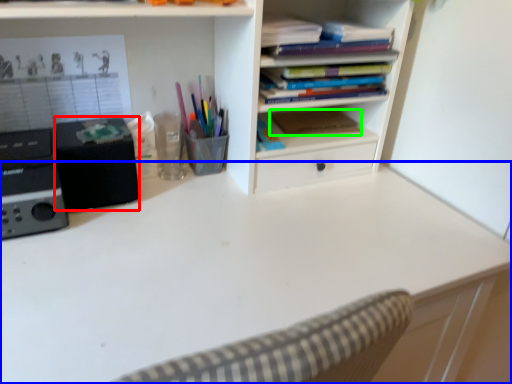
Question: Which is farther away from speaker (highlighted by a red box)? desk (highlighted by a blue box) or paperback book (highlighted by a green box)?

Choices:
 (A) desk
 (B) paperback book

Answer: (B)